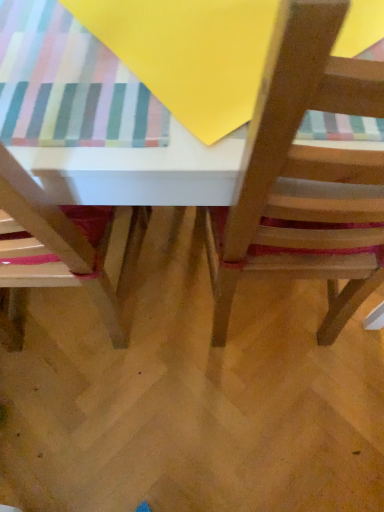
The width and height of the screenshot is (384, 512). What are the coordinates of `free space in front of wooden chair at center, placed as the second chair when sorted from left to right` in the screenshot? It's located at (273, 424).